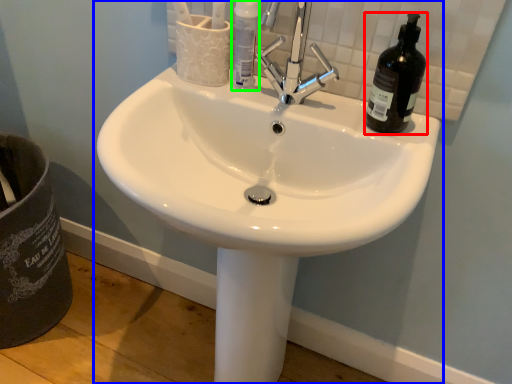
Question: Which is nearer to the beer bottle (highlighted by a red box)? sink (highlighted by a blue box) or bottle (highlighted by a green box).

Choices:
 (A) sink
 (B) bottle

Answer: (B)